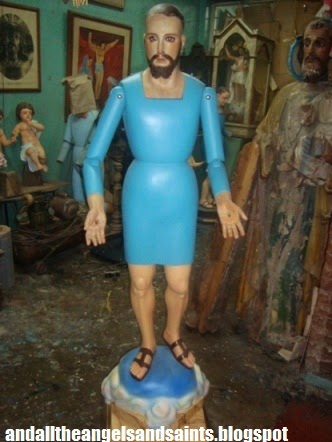
You are a GUI agent. You are given a task and a screenshot of the screen. Output one action in this format:
    pyautogui.click(x=<x>, y=<y>)
    Task: Click on the blue-green wall
    This screenshot has width=332, height=442.
    Given the screenshot: What is the action you would take?
    pyautogui.click(x=52, y=43)